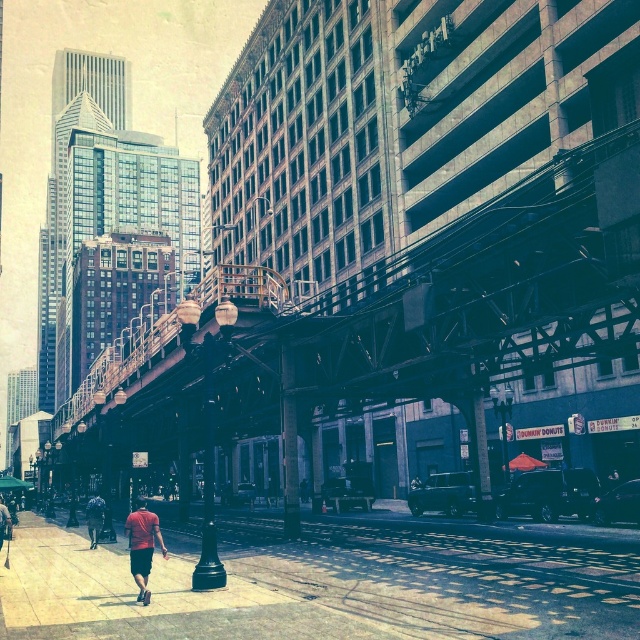
Does black glossy streetlight at center appear on the right side of red shirt at lower left?

Indeed, black glossy streetlight at center is positioned on the right side of red shirt at lower left.

Is point (211, 362) farther from camera compared to point (10, 528)?

No, it is not.

Find the location of a particular element. The width and height of the screenshot is (640, 640). black glossy streetlight at center is located at coordinates (209, 484).

This screenshot has width=640, height=640. Identify the location of smooth concrete sidewalk at center. (332, 580).

In the scene shown: Does smooth concrete sidewalk at center lie in front of red shirt at lower left?

Yes, smooth concrete sidewalk at center is in front of red shirt at lower left.

Is point (637, 586) in front of point (3, 528)?

Yes, it is.

Where is `smooth concrete sidewalk at center`? smooth concrete sidewalk at center is located at coordinates (332, 580).

Who is taller, red cotton t-shirt at center or red shirt at lower left?

red shirt at lower left is taller.

Does point (131, 513) lie behind point (6, 513)?

No, (131, 513) is closer to viewer.

Describe the element at coordinates (141, 545) in the screenshot. I see `red cotton t-shirt at center` at that location.

Identify the location of red cotton t-shirt at center. This screenshot has height=640, width=640. (141, 545).